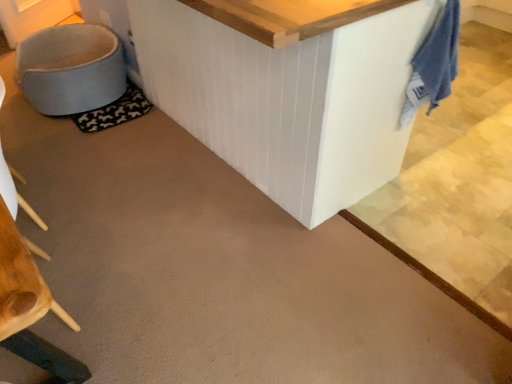
Question: Could you tell me if blue cotton towel at upper right is facing light blue fabric swivel chair at lower left?

Choices:
 (A) no
 (B) yes

Answer: (A)

Question: Are blue cotton towel at upper right and light blue fabric swivel chair at lower left beside each other?

Choices:
 (A) no
 (B) yes

Answer: (A)

Question: Considering the relative sizes of blue cotton towel at upper right and light blue fabric swivel chair at lower left in the image provided, is blue cotton towel at upper right smaller than light blue fabric swivel chair at lower left?

Choices:
 (A) no
 (B) yes

Answer: (B)

Question: Is blue cotton towel at upper right positioned in front of light blue fabric swivel chair at lower left?

Choices:
 (A) yes
 (B) no

Answer: (A)

Question: From a real-world perspective, is blue cotton towel at upper right located beneath light blue fabric swivel chair at lower left?

Choices:
 (A) no
 (B) yes

Answer: (A)

Question: Does point (126, 120) appear closer or farther from the camera than point (48, 49)?

Choices:
 (A) closer
 (B) farther

Answer: (A)

Question: Considering the positions of black fabric mat at lower left and light blue fabric swivel chair at lower left in the image, is black fabric mat at lower left taller or shorter than light blue fabric swivel chair at lower left?

Choices:
 (A) tall
 (B) short

Answer: (B)

Question: Considering the relative positions of black fabric mat at lower left and light blue fabric swivel chair at lower left in the image provided, is black fabric mat at lower left to the left or to the right of light blue fabric swivel chair at lower left?

Choices:
 (A) right
 (B) left

Answer: (A)

Question: In terms of size, does black fabric mat at lower left appear bigger or smaller than light blue fabric swivel chair at lower left?

Choices:
 (A) big
 (B) small

Answer: (B)

Question: Does point (97, 79) appear closer or farther from the camera than point (137, 89)?

Choices:
 (A) farther
 (B) closer

Answer: (B)

Question: From a real-world perspective, is light blue fabric swivel chair at lower left above or below black fabric mat at lower left?

Choices:
 (A) below
 (B) above

Answer: (B)

Question: In the image, is light blue fabric swivel chair at lower left on the left side or the right side of black fabric mat at lower left?

Choices:
 (A) left
 (B) right

Answer: (A)

Question: Is light blue fabric swivel chair at lower left wider or thinner than black fabric mat at lower left?

Choices:
 (A) thin
 (B) wide

Answer: (B)

Question: In terms of width, does blue cotton towel at upper right look wider or thinner when compared to black fabric mat at lower left?

Choices:
 (A) thin
 (B) wide

Answer: (A)

Question: In terms of height, does blue cotton towel at upper right look taller or shorter compared to black fabric mat at lower left?

Choices:
 (A) tall
 (B) short

Answer: (A)